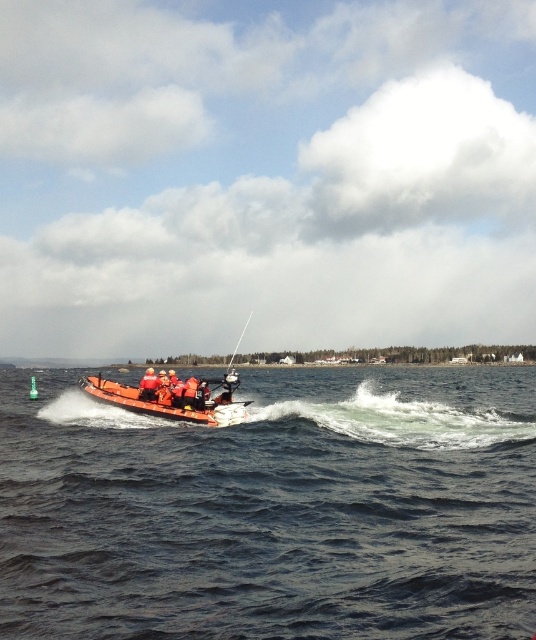
Is point (446, 608) positioned before point (232, 376)?

Yes, it is in front of point (232, 376).

Based on the photo, does dark blue water at center lie in front of orange rubber boat at center?

Yes, it is.

Is point (316, 547) more distant than point (222, 378)?

No.

Image resolution: width=536 pixels, height=640 pixels. Identify the location of dark blue water at center. (273, 508).

This screenshot has height=640, width=536. Describe the element at coordinates (173, 397) in the screenshot. I see `orange rubber boat at center` at that location.

Is point (219, 419) farther from viewer compared to point (153, 387)?

No.

Locate an element on the screen. The image size is (536, 640). orange rubber boat at center is located at coordinates (173, 397).

Does point (400, 467) come farther from viewer compared to point (140, 392)?

No, (400, 467) is in front of (140, 392).

From the picture: Is dark blue water at center below orange life jacket at center?

Indeed, dark blue water at center is positioned under orange life jacket at center.

Which is in front, point (9, 419) or point (158, 387)?

Point (158, 387) is in front.

Identify the location of dark blue water at center. (273, 508).